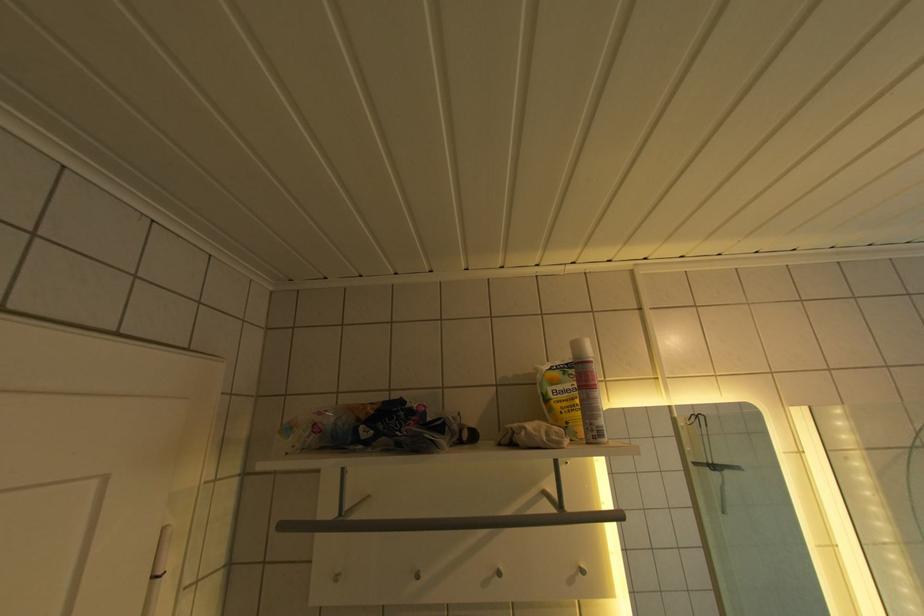
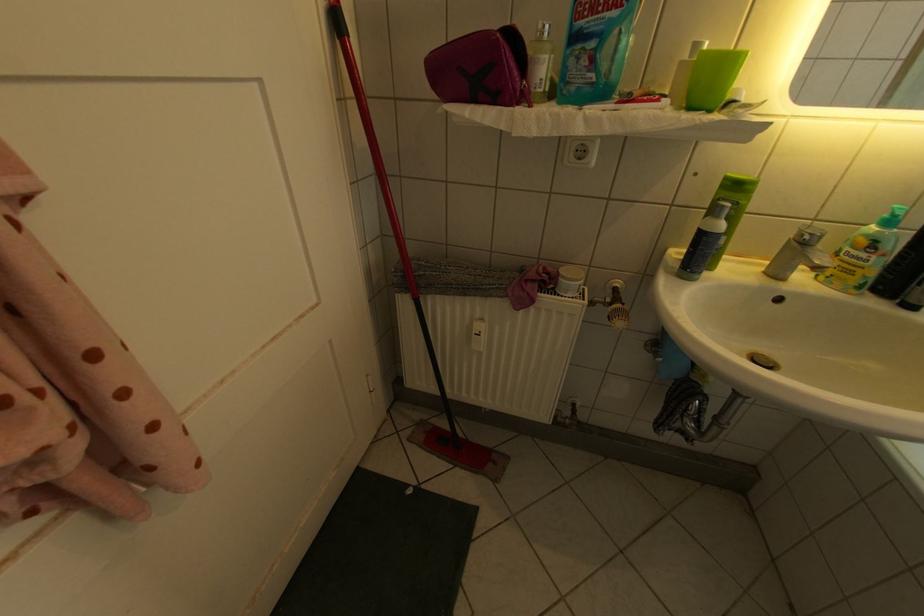
The first image is from the beginning of the video and the second image is from the end. How did the camera likely rotate when shooting the video?

The rotation direction of the camera is left-down.